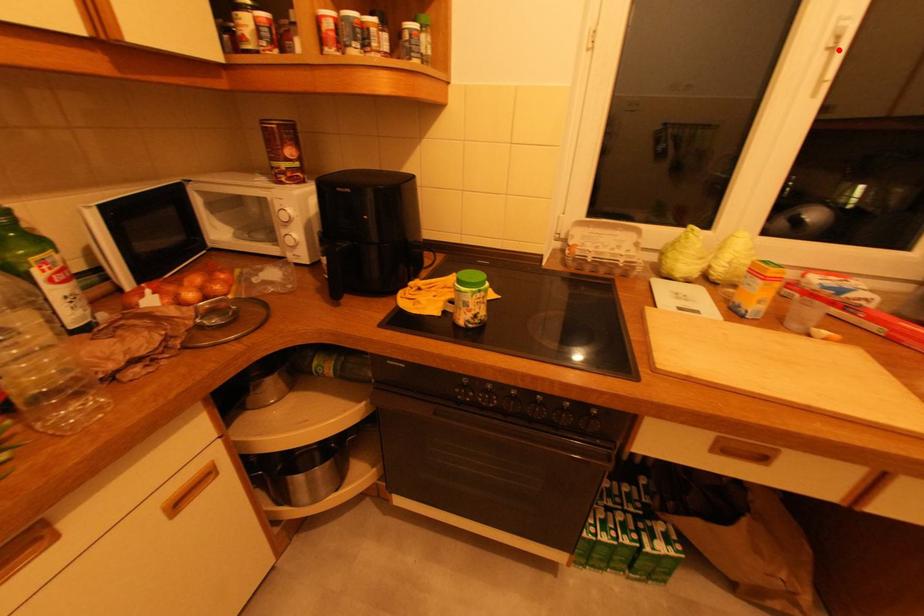
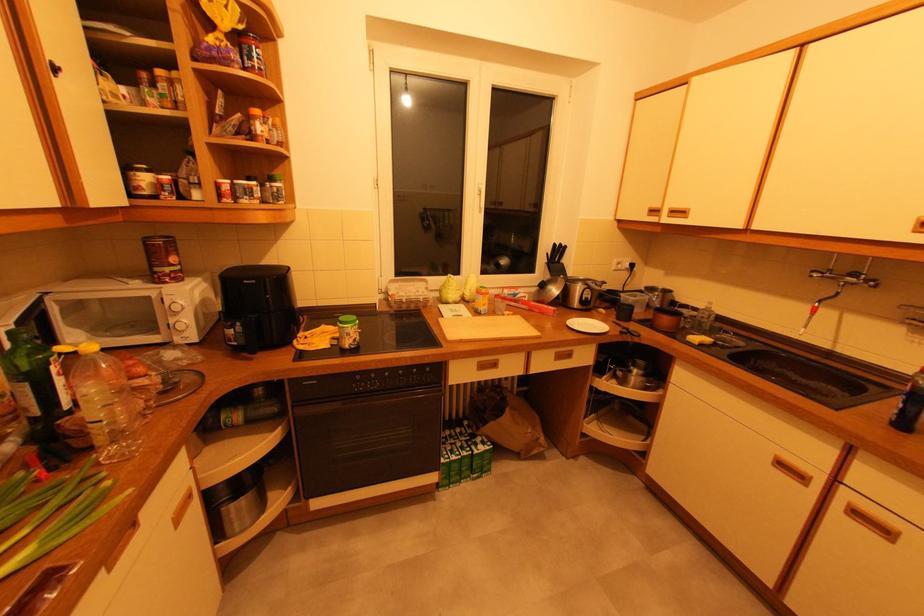
Question: I am providing you with two images of the same scene from different viewpoints. A red point is shown in image1. For the corresponding object point in image2, is it positioned nearer or farther from the camera?

Choices:
 (A) Nearer
 (B) Farther

Answer: (A)